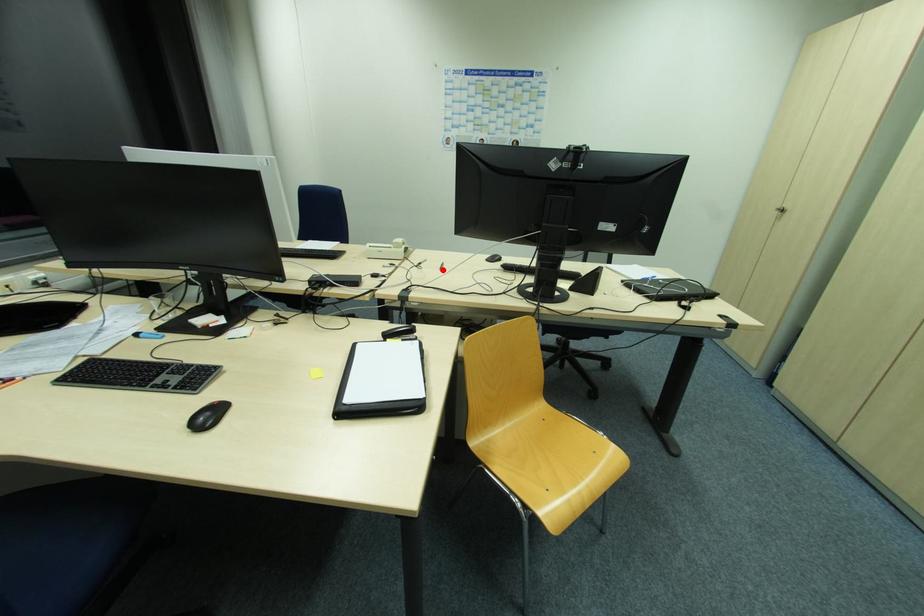
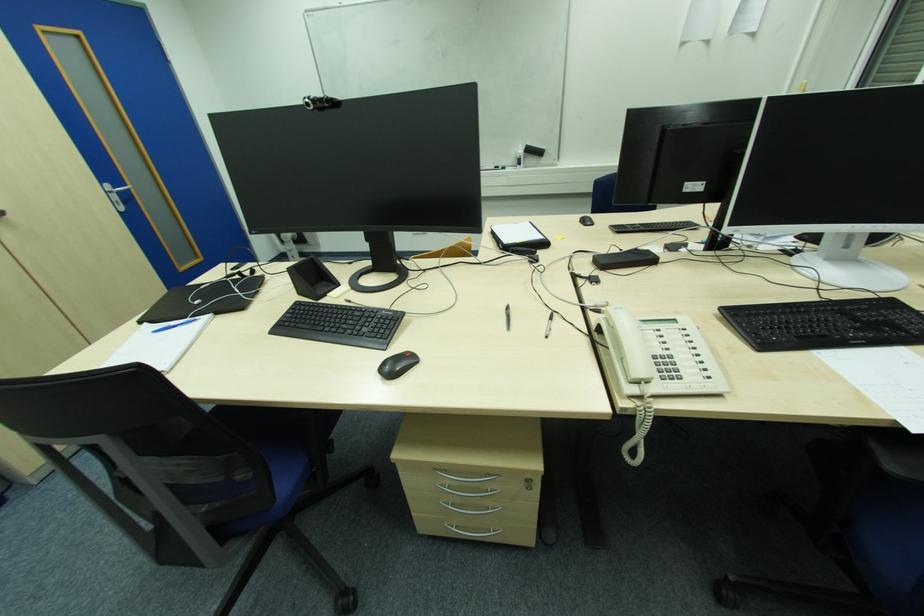
Where in the second image is the point corresponding to the highlighted location from the first image?

(509, 309)